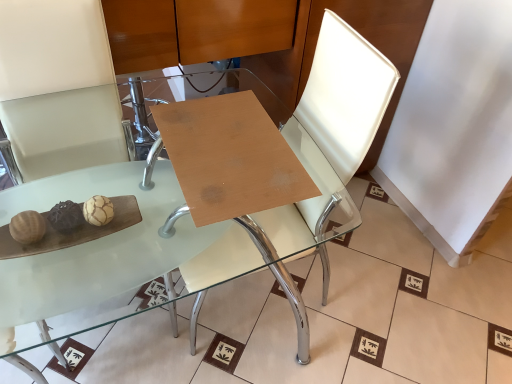
The image size is (512, 384). What are the coordinates of `vacant space situated above wooden at center, the 1th table in the back-to-front sequence (from a real-world perspective)` in the screenshot? It's located at (230, 146).